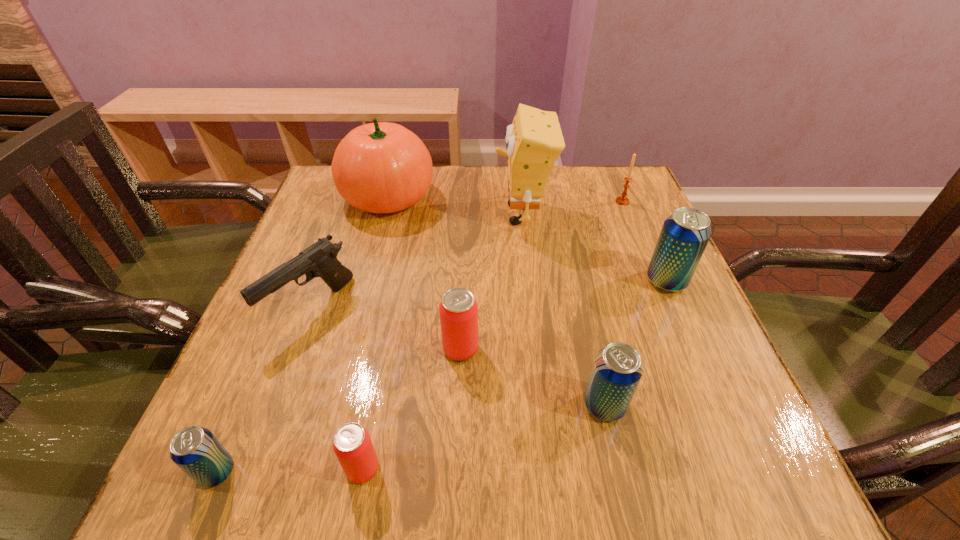
I want to click on free location that satisfies the following two spatial constraints: 1. on the back side of the nearer red beer can; 2. on the right side of the candle_holder, so click(x=414, y=201).

Where is `vacant area in the image that satisfies the following two spatial constraints: 1. on the back side of the second farthest beer can; 2. on the left side of the nearer red beer can`? The width and height of the screenshot is (960, 540). vacant area in the image that satisfies the following two spatial constraints: 1. on the back side of the second farthest beer can; 2. on the left side of the nearer red beer can is located at coordinates (385, 349).